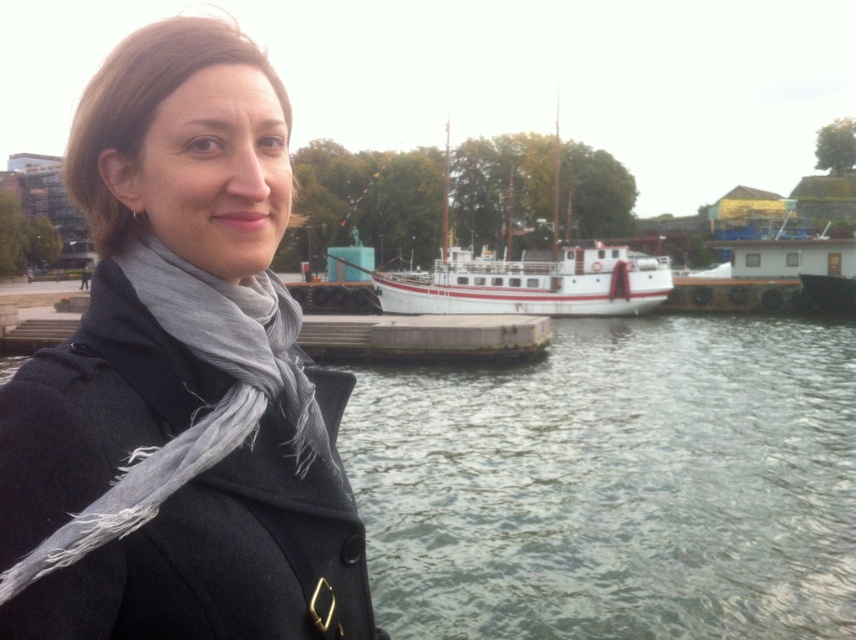
Who is positioned more to the left, greenish water at lower center or white matte boat at center?

greenish water at lower center

Describe the element at coordinates (616, 484) in the screenshot. Image resolution: width=856 pixels, height=640 pixels. I see `greenish water at lower center` at that location.

Where is `greenish water at lower center`? This screenshot has width=856, height=640. greenish water at lower center is located at coordinates (616, 484).

Which of these two, greenish water at lower center or gray fringed scarf at left, stands shorter?

gray fringed scarf at left is shorter.

Find the location of a particular element. The height and width of the screenshot is (640, 856). greenish water at lower center is located at coordinates (616, 484).

Consider the image. Is gray fringed scarf at left to the right of white matte boat at center from the viewer's perspective?

No, gray fringed scarf at left is not to the right of white matte boat at center.

Consider the image. Does gray fringed scarf at left have a greater width compared to white matte boat at center?

Incorrect, gray fringed scarf at left's width does not surpass white matte boat at center's.

Between point (100, 540) and point (533, 307), which one is positioned behind?

The point (533, 307) is more distant.

Identify the location of gray fringed scarf at left. This screenshot has width=856, height=640. (204, 413).